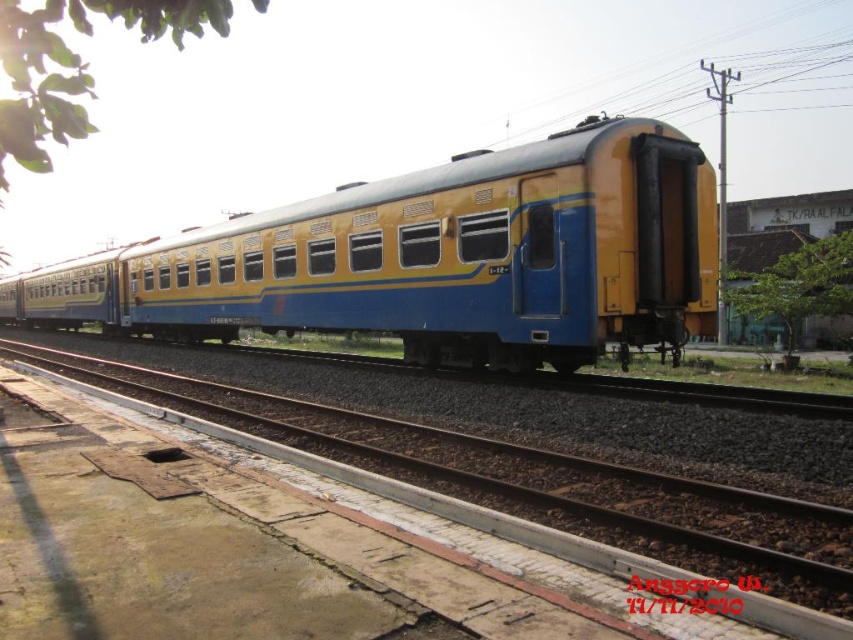
You are standing on the platform looking at the train. You notice the brown gravel track at center and the green leafy tree at right. Which object is closer to your left side?

The brown gravel track at center is positioned on the left side of green leafy tree at right, so the brown gravel track at center is closer to your left side.

You are standing on the platform and notice the yellow matte train car at center and the green leafy tree at right. Which object appears taller from your viewpoint?

The green leafy tree at right appears taller than the yellow matte train car at center from your viewpoint.